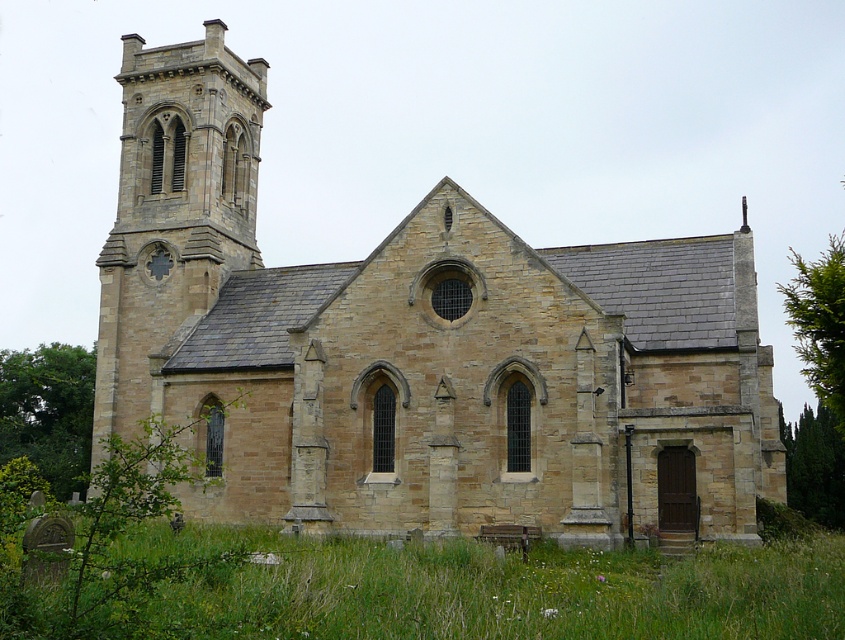
Which is behind, point (415, 230) or point (134, 625)?

The point (415, 230) is more distant.

Is point (518, 497) positioned in front of point (324, 593)?

No.

You are a GUI agent. You are given a task and a screenshot of the screen. Output one action in this format:
    pyautogui.click(x=<x>, y=<y>)
    Task: Click on the beige stone church at center
    
    Given the screenshot: What is the action you would take?
    pyautogui.click(x=418, y=349)